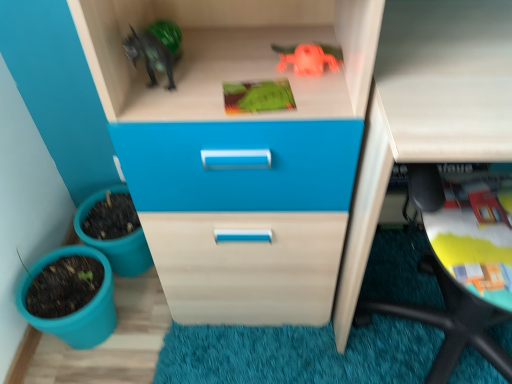
Question: Considering their positions, is green matte toy at upper center, positioned as the first toy in bottom-to-top order, located in front of or behind rubber orange toy at upper center, positioned as the second toy in bottom-to-top order?

Choices:
 (A) front
 (B) behind

Answer: (A)

Question: Is green matte toy at upper center, positioned as the first toy in bottom-to-top order, bigger or smaller than rubber orange toy at upper center, positioned as the second toy in bottom-to-top order?

Choices:
 (A) big
 (B) small

Answer: (B)

Question: Considering the real-world distances, which object is farthest from the matte plastic flowerpot at lower left, which is the 2th flowerpot from top to bottom?

Choices:
 (A) matte white computer desk at lower right
 (B) rubber orange toy at upper center, positioned as the second toy in bottom-to-top order
 (C) teal plastic flowerpot at lower left, which is the 1th flowerpot in top-to-bottom order
 (D) green matte toy at upper center, positioned as the first toy in bottom-to-top order

Answer: (B)

Question: Based on their relative distances, which object is nearer to the rubber orange toy at upper center, the 1th toy positioned from the top?

Choices:
 (A) teal plastic flowerpot at lower left, which is the 1th flowerpot in top-to-bottom order
 (B) matte white computer desk at lower right
 (C) matte plastic flowerpot at lower left, which is the 1th flowerpot in bottom-to-top order
 (D) green matte toy at upper center, positioned as the first toy in bottom-to-top order

Answer: (D)